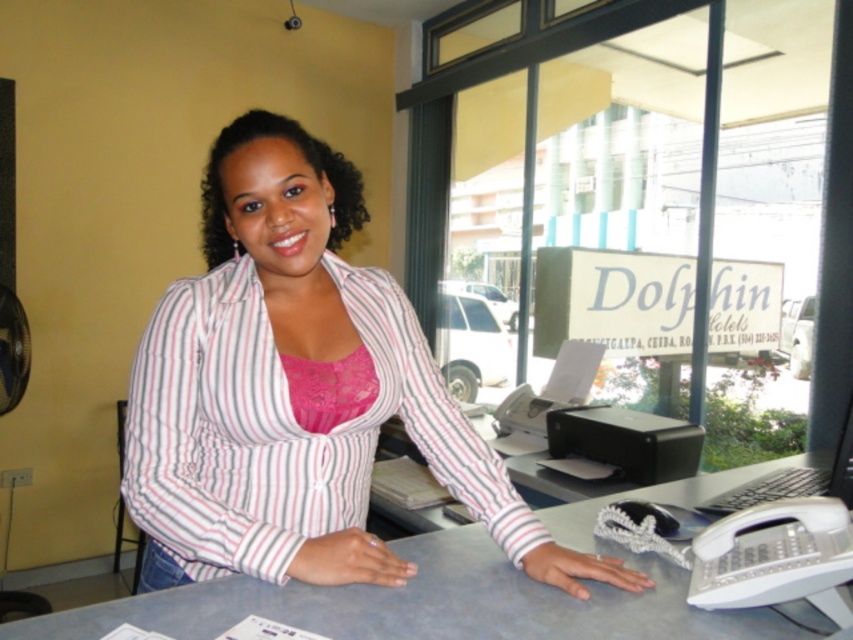
Question: Where is gray matte table at center located in relation to black plastic computer at lower right in the image?

Choices:
 (A) right
 (B) left

Answer: (B)

Question: Can you confirm if striped cotton shirt at center is positioned above gray matte table at center?

Choices:
 (A) yes
 (B) no

Answer: (A)

Question: Which point is closer to the camera taking this photo?

Choices:
 (A) [838, 465]
 (B) [190, 525]

Answer: (B)

Question: Which point is closer to the camera taking this photo?

Choices:
 (A) (808, 492)
 (B) (524, 627)
 (C) (161, 419)

Answer: (B)

Question: Is striped cotton shirt at center positioned in front of gray matte table at center?

Choices:
 (A) yes
 (B) no

Answer: (B)

Question: Which point is farther to the camera?

Choices:
 (A) (407, 422)
 (B) (727, 472)

Answer: (B)